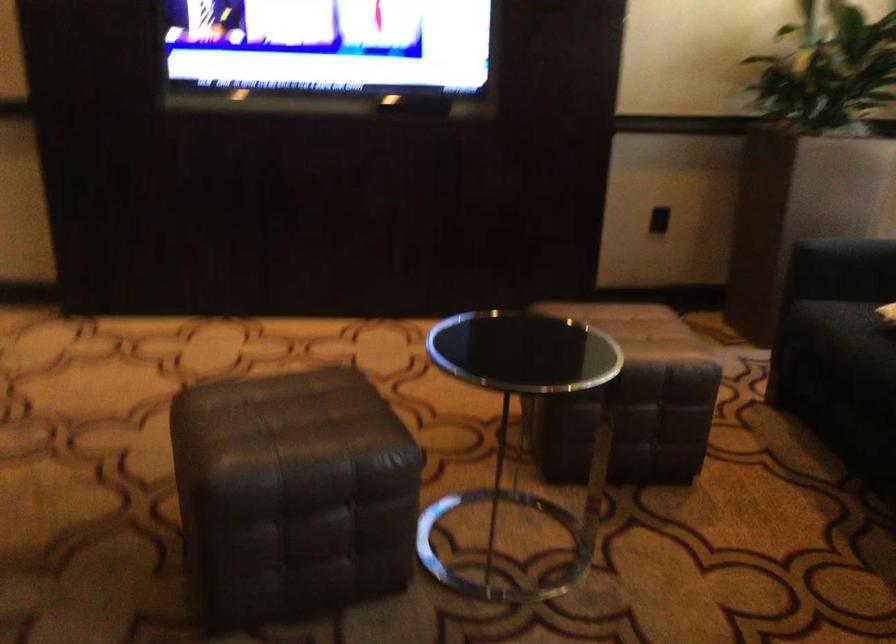
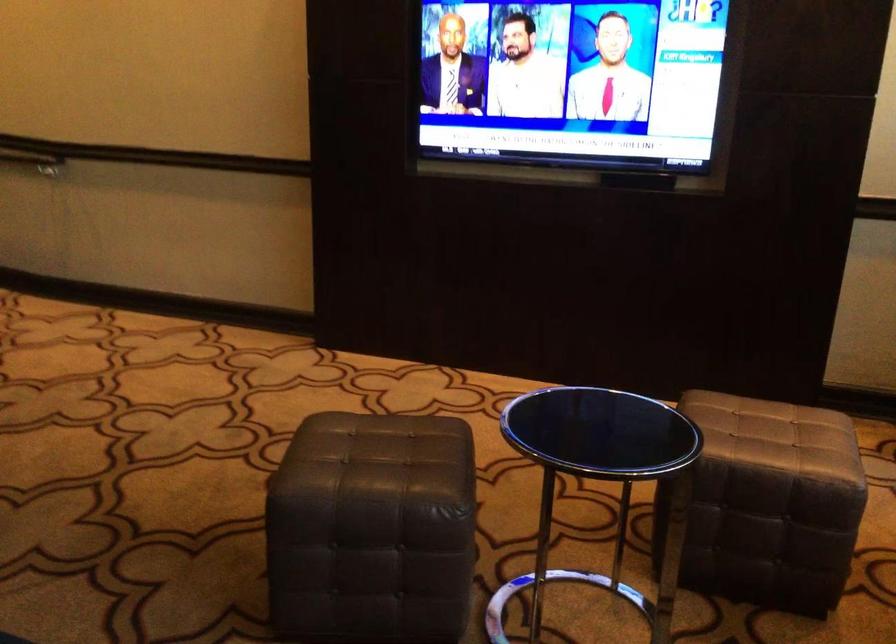
Question: The images are taken continuously from a first-person perspective. In which direction are you moving?

Choices:
 (A) Left
 (B) Right
 (C) Forward
 (D) Backward

Answer: (B)